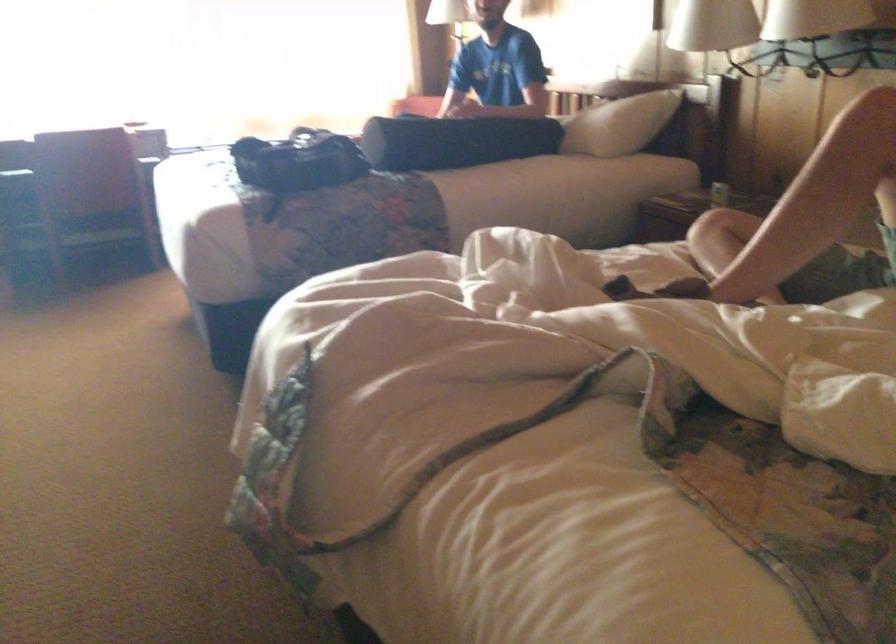
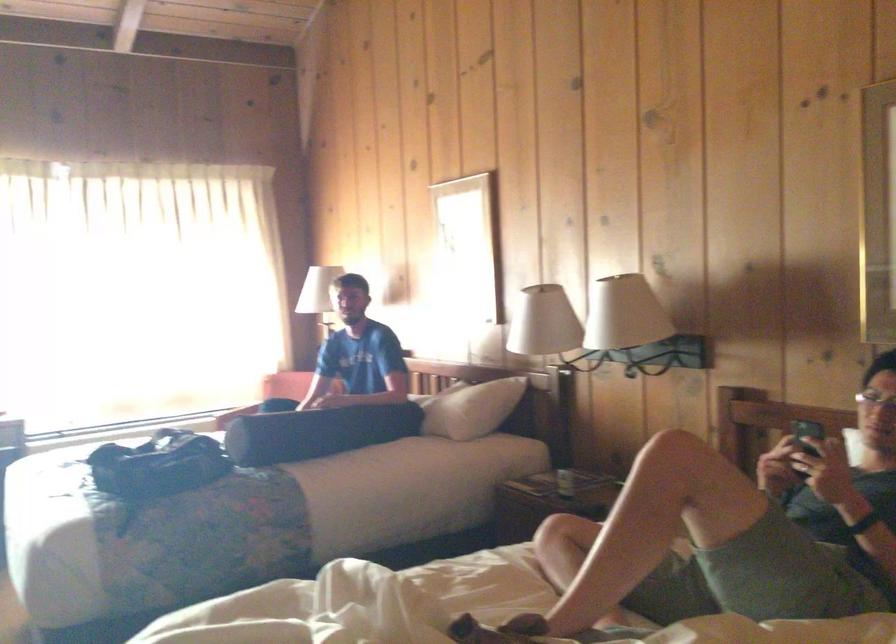
Question: Based on the continuous images, in which direction is the camera rotating? Reply with the corresponding letter.

Choices:
 (A) Left
 (B) Right
 (C) Up
 (D) Down

Answer: (C)